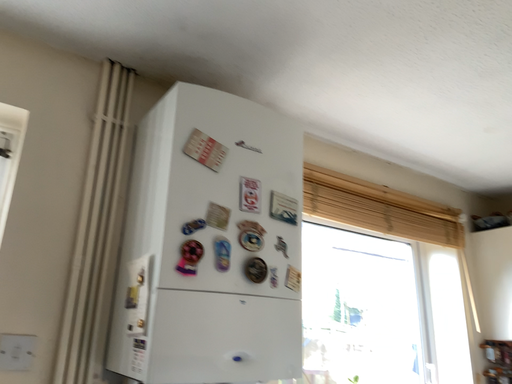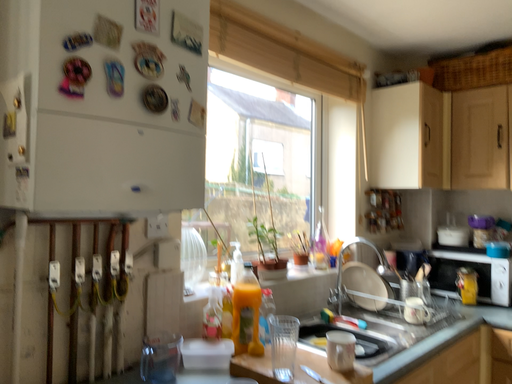
Question: How did the camera likely rotate when shooting the video?

Choices:
 (A) rotated downward
 (B) rotated upward

Answer: (A)